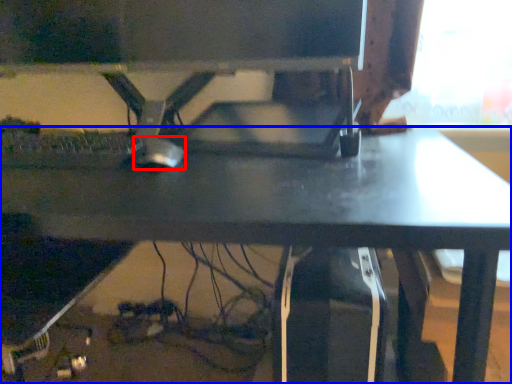
Question: Which object is further to the camera taking this photo, mouse (highlighted by a red box) or desk (highlighted by a blue box)?

Choices:
 (A) mouse
 (B) desk

Answer: (A)